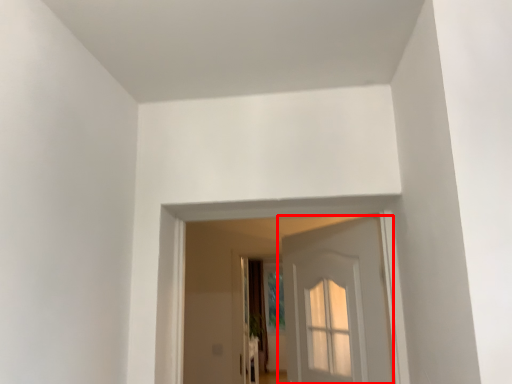
Question: From the image's perspective, where is door (annotated by the red box) located relative to curtain?

Choices:
 (A) above
 (B) below

Answer: (A)